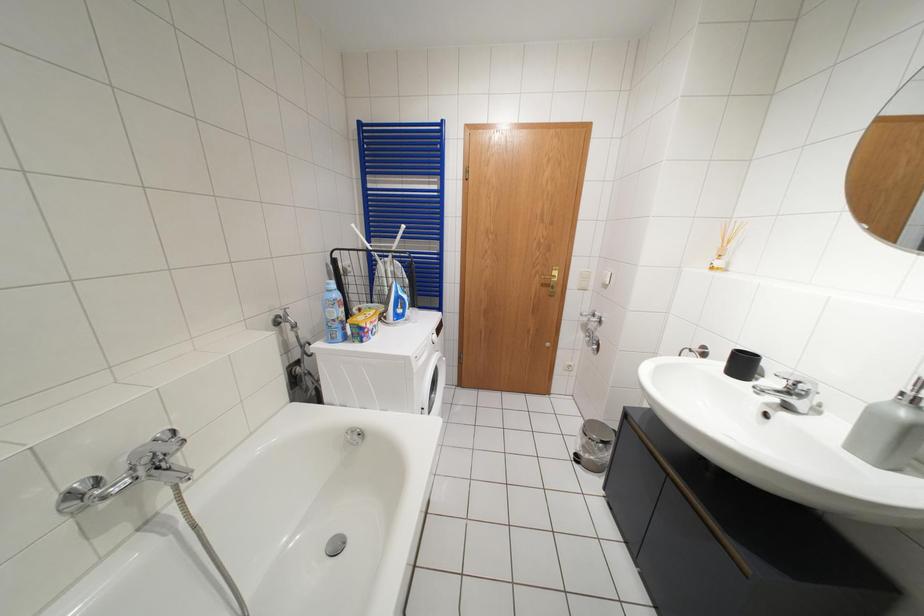
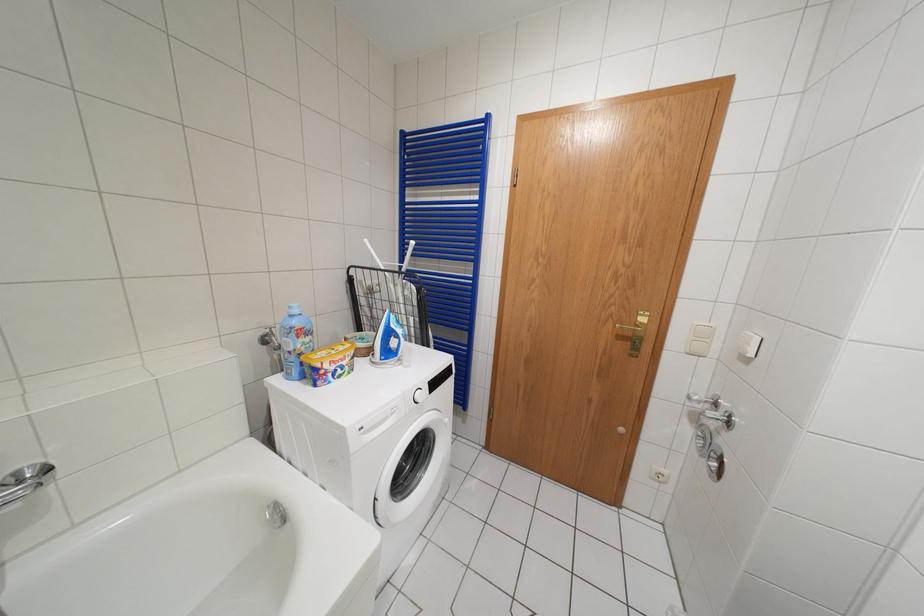
Question: How did the camera likely rotate?

Choices:
 (A) Left
 (B) Right
 (C) Up
 (D) Down

Answer: (A)